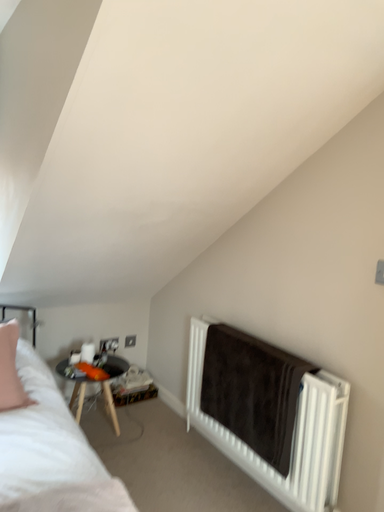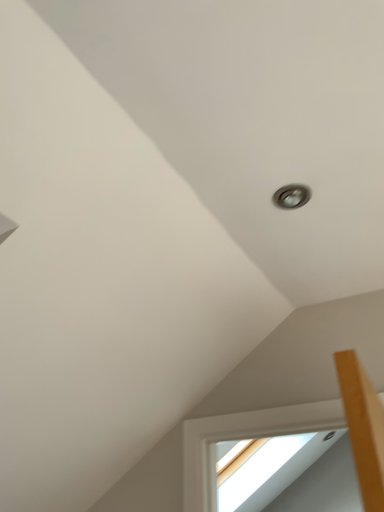
Question: Which way did the camera rotate in the video?

Choices:
 (A) rotated left
 (B) rotated right

Answer: (B)